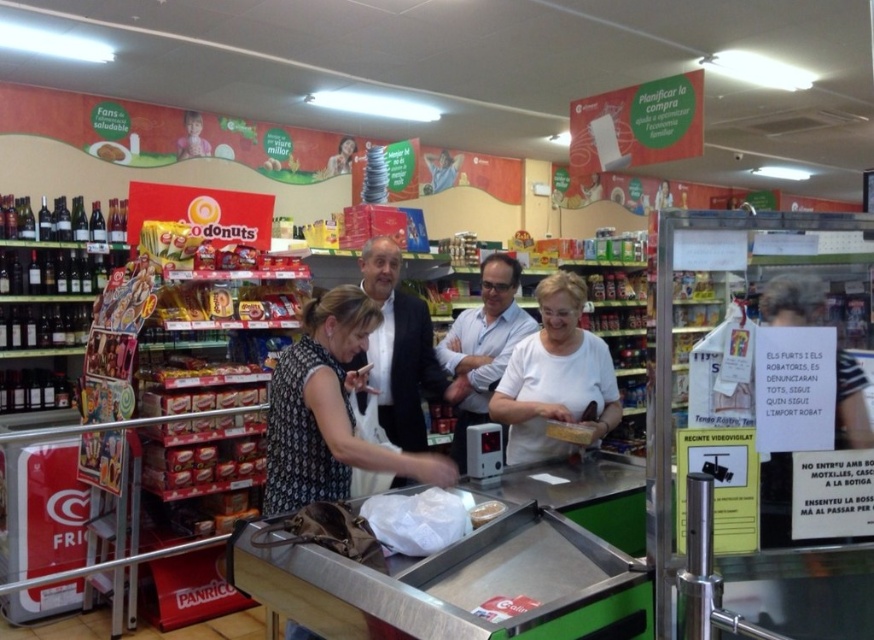
Question: Which point appears closest to the camera in this image?

Choices:
 (A) (328, 296)
 (B) (586, 432)

Answer: (A)

Question: Is black printed dress at center thinner than dark gray suit at center?

Choices:
 (A) yes
 (B) no

Answer: (B)

Question: Does black printed dress at center have a smaller size compared to matte cardboard snack at center?

Choices:
 (A) yes
 (B) no

Answer: (B)

Question: Does translucent plastic container at center appear under matte cardboard snack at center?

Choices:
 (A) no
 (B) yes

Answer: (B)

Question: Which point is farther to the camera?

Choices:
 (A) matte cardboard snack at center
 (B) white smooth shirt at center

Answer: (A)

Question: Which object is positioned farthest from the translucent plastic bag at center?

Choices:
 (A) translucent plastic container at center
 (B) matte cardboard snack at center

Answer: (B)